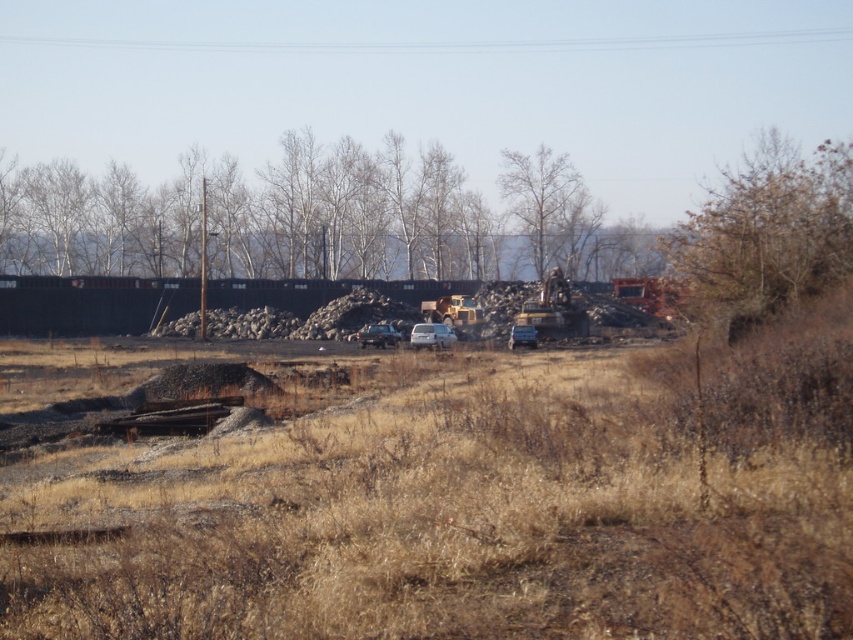
Which is behind, point (109, 371) or point (448, 328)?

The point (448, 328) is behind.

Does brown dry grass at center have a larger size compared to white matte car at center?

Correct, brown dry grass at center is larger in size than white matte car at center.

You are a GUI agent. You are given a task and a screenshot of the screen. Output one action in this format:
    pyautogui.click(x=<x>, y=<y>)
    Task: Click on the brown dry grass at center
    
    Given the screenshot: What is the action you would take?
    pyautogui.click(x=462, y=502)

I want to click on brown dry grass at center, so click(462, 502).

Does brown dry grass at center have a smaller size compared to metallic yellow excavator at center?

Incorrect, brown dry grass at center is not smaller in size than metallic yellow excavator at center.

Which is in front, point (340, 545) or point (527, 308)?

Positioned in front is point (340, 545).

Locate an element on the screen. brown dry grass at center is located at coordinates (462, 502).

Between bare wood tree at upper center and metallic yellow excavator at center, which one is positioned lower?

metallic yellow excavator at center

This screenshot has width=853, height=640. Describe the element at coordinates (537, 193) in the screenshot. I see `bare wood tree at upper center` at that location.

Does point (543, 196) lie behind point (582, 321)?

Yes, point (543, 196) is behind point (582, 321).

Identify the location of bare wood tree at upper center. This screenshot has width=853, height=640. point(537,193).